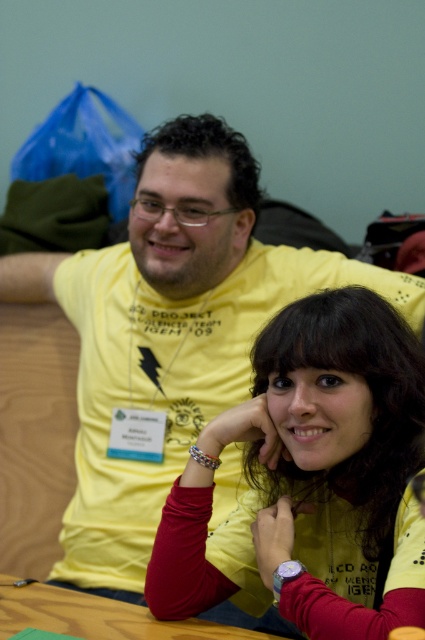
Is matte yellow shirt at center smaller than metallic bracelet at lower center?

No.

Between matte yellow shirt at center and metallic bracelet at lower center, which one is positioned higher?

Positioned higher is matte yellow shirt at center.

What are the coordinates of `matte yellow shirt at center` in the screenshot? It's located at (309, 477).

Locate an element on the screen. matte yellow shirt at center is located at coordinates (309, 477).

Which is below, metallic bracelet at lower center or multicolored fabric bracelet at lower center?

metallic bracelet at lower center

Measure the distance between metallic bracelet at lower center and camera.

The distance of metallic bracelet at lower center from camera is 99.17 centimeters.

This screenshot has height=640, width=425. I want to click on metallic bracelet at lower center, so click(285, 577).

Who is more forward, (380, 618) or (193, 458)?

Point (380, 618)

Who is lower down, matte yellow shirt at center or multicolored fabric bracelet at lower center?

matte yellow shirt at center is below.

Is point (399, 397) positioned after point (198, 452)?

No, (399, 397) is closer to viewer.

Identify the location of matte yellow shirt at center. (309, 477).